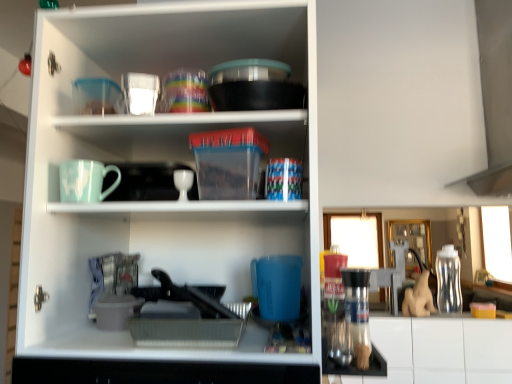
Question: In which direction should I rotate to look at translucent plastic cups at upper center, which appears as the 1th tableware when viewed from the top?

Choices:
 (A) left
 (B) right

Answer: (A)

Question: Are white glossy egg cup at center, which is the 3th tableware from top to bottom, and gray plastic tray at lower center beside each other?

Choices:
 (A) yes
 (B) no

Answer: (B)

Question: Considering the relative sizes of white glossy egg cup at center, arranged as the 1th tableware when ordered from the bottom, and gray plastic tray at lower center in the image provided, is white glossy egg cup at center, arranged as the 1th tableware when ordered from the bottom, taller than gray plastic tray at lower center?

Choices:
 (A) yes
 (B) no

Answer: (A)

Question: From a real-world perspective, is white glossy egg cup at center, arranged as the 1th tableware when ordered from the bottom, on top of gray plastic tray at lower center?

Choices:
 (A) no
 (B) yes

Answer: (B)

Question: Could you tell me if white glossy egg cup at center, which is the 3th tableware from top to bottom, is facing gray plastic tray at lower center?

Choices:
 (A) no
 (B) yes

Answer: (A)

Question: Is white glossy egg cup at center, arranged as the 1th tableware when ordered from the bottom, positioned beyond the bounds of gray plastic tray at lower center?

Choices:
 (A) yes
 (B) no

Answer: (A)

Question: Is white glossy egg cup at center, arranged as the 1th tableware when ordered from the bottom, closer to camera compared to gray plastic tray at lower center?

Choices:
 (A) no
 (B) yes

Answer: (A)

Question: Is transparent plastic bottle at right located outside white glossy egg cup at center, arranged as the 1th tableware when ordered from the bottom?

Choices:
 (A) no
 (B) yes

Answer: (B)

Question: Is the depth of transparent plastic bottle at right greater than that of white glossy egg cup at center, arranged as the 1th tableware when ordered from the bottom?

Choices:
 (A) no
 (B) yes

Answer: (B)

Question: Can you confirm if transparent plastic bottle at right is smaller than white glossy egg cup at center, arranged as the 1th tableware when ordered from the bottom?

Choices:
 (A) yes
 (B) no

Answer: (B)

Question: Can you confirm if transparent plastic bottle at right is taller than white glossy egg cup at center, which is the 3th tableware from top to bottom?

Choices:
 (A) yes
 (B) no

Answer: (A)

Question: Is transparent plastic bottle at right facing away from white glossy egg cup at center, arranged as the 1th tableware when ordered from the bottom?

Choices:
 (A) yes
 (B) no

Answer: (B)

Question: Does transparent plastic bottle at right have a greater width compared to white glossy egg cup at center, arranged as the 1th tableware when ordered from the bottom?

Choices:
 (A) no
 (B) yes

Answer: (B)

Question: Can you confirm if matte ceramic mug at upper left is positioned to the right of transparent plastic bottle at right?

Choices:
 (A) no
 (B) yes

Answer: (A)